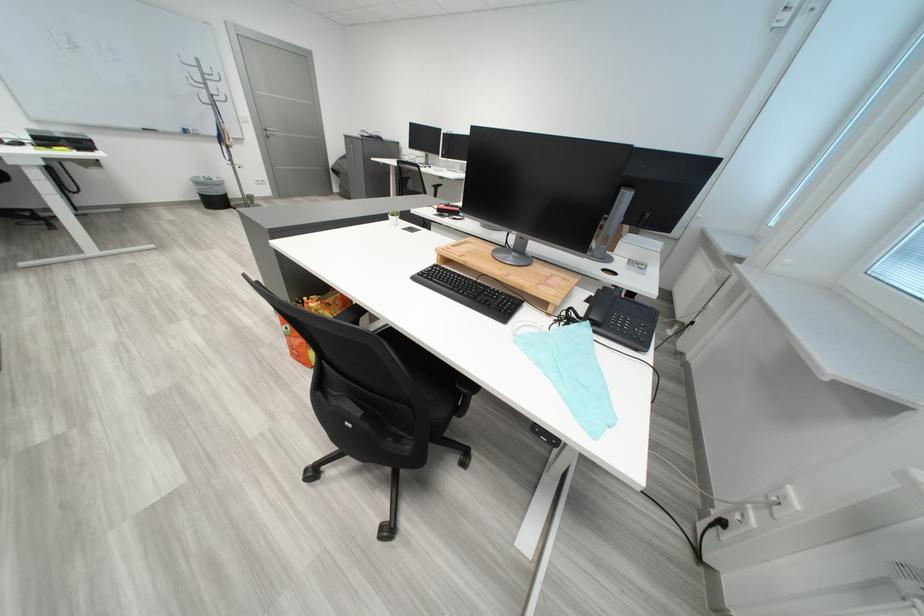
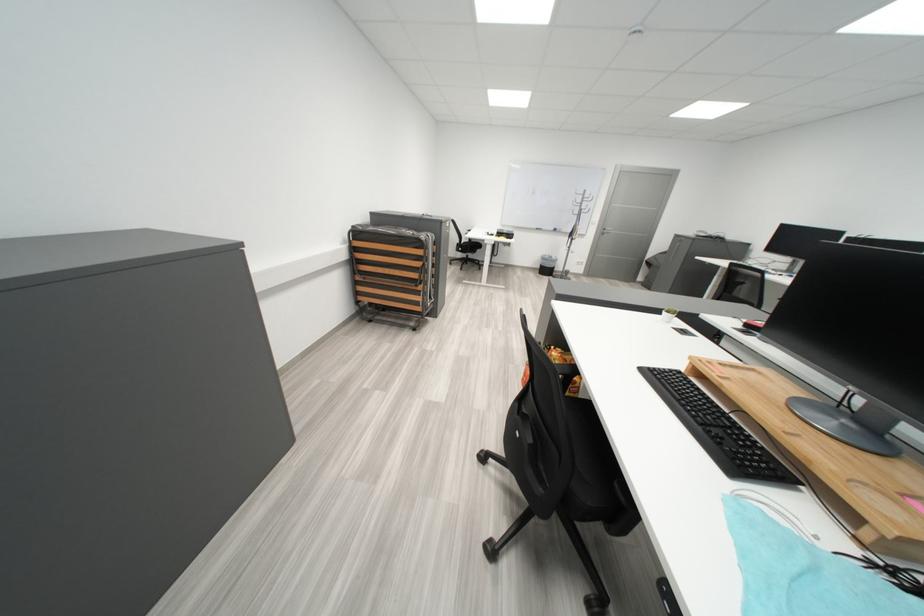
Question: The camera is either moving clockwise (left) or counter-clockwise (right) around the object. The first image is from the beginning of the video and the second image is from the end. Is the camera moving left or right when shooting the video?

Choices:
 (A) Left
 (B) Right

Answer: (B)